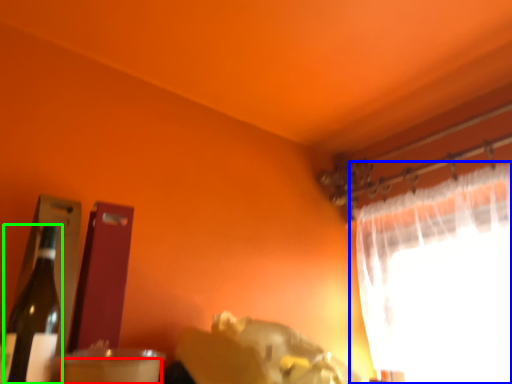
Question: Which is farther away from drinking straw (highlighted by a red box)? curtain (highlighted by a blue box) or bottle (highlighted by a green box)?

Choices:
 (A) curtain
 (B) bottle

Answer: (A)